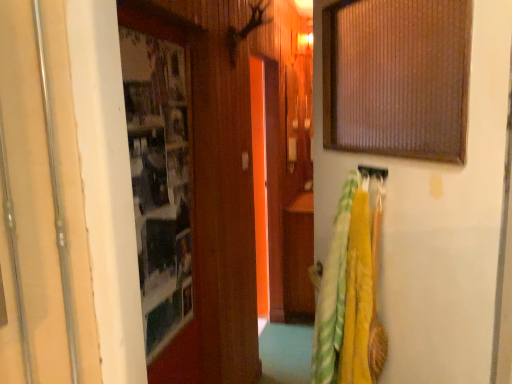
The image size is (512, 384). Identify the location of yellow fabric towel at right. click(x=351, y=290).

From the image's perspective, is metallic silver door at left beneath transparent glass door at center?

Incorrect, from the image's perspective, metallic silver door at left is higher than transparent glass door at center.

How distant is metallic silver door at left from transparent glass door at center?

The distance of metallic silver door at left from transparent glass door at center is 6.42 feet.

Considering the relative sizes of metallic silver door at left and transparent glass door at center in the image provided, is metallic silver door at left smaller than transparent glass door at center?

Yes.

The height and width of the screenshot is (384, 512). In order to click on door that appears above the transparent glass door at center (from a real-world perspective) in this screenshot , I will do pyautogui.click(x=42, y=204).

From the image's perspective, relative to metallic silver door at left, is transparent glass door at center above or below?

transparent glass door at center is below metallic silver door at left.

Considering the sizes of transparent glass door at center and metallic silver door at left in the image, is transparent glass door at center bigger or smaller than metallic silver door at left?

Considering their sizes, transparent glass door at center takes up more space than metallic silver door at left.

Is transparent glass door at center at the right side of metallic silver door at left?

Yes, transparent glass door at center is to the right of metallic silver door at left.

Considering the relative sizes of transparent glass door at center and metallic silver door at left in the image provided, is transparent glass door at center thinner than metallic silver door at left?

No, transparent glass door at center is not thinner than metallic silver door at left.

Which object is positioned more to the left, transparent glass door at center or yellow fabric towel at right?

Positioned to the left is transparent glass door at center.

From a real-world perspective, is transparent glass door at center physically located above or below yellow fabric towel at right?

From a real-world perspective, transparent glass door at center is physically below yellow fabric towel at right.

Does transparent glass door at center come in front of yellow fabric towel at right?

That is False.

Is yellow fabric towel at right in front of or behind transparent glass door at center in the image?

Clearly, yellow fabric towel at right is in front of transparent glass door at center.

Who is bigger, yellow fabric towel at right or transparent glass door at center?

transparent glass door at center is bigger.

Between point (358, 265) and point (281, 222), which one is positioned behind?

The point (281, 222) is behind.

Is the surface of yellow fabric towel at right in direct contact with transparent glass door at center?

No, yellow fabric towel at right is not making contact with transparent glass door at center.

Consider the image. Is yellow fabric towel at right wider than metallic silver door at left?

Yes.

Could you tell me if yellow fabric towel at right is turned towards metallic silver door at left?

Yes, yellow fabric towel at right is facing metallic silver door at left.

Does point (366, 263) come in front of point (38, 288)?

No.

Looking at this image, are yellow fabric towel at right and metallic silver door at left far apart?

No.

From their relative heights in the image, would you say metallic silver door at left is taller or shorter than yellow fabric towel at right?

Clearly, metallic silver door at left is taller compared to yellow fabric towel at right.

Is metallic silver door at left wider than yellow fabric towel at right?

In fact, metallic silver door at left might be narrower than yellow fabric towel at right.

Is metallic silver door at left located outside yellow fabric towel at right?

Yes, metallic silver door at left is outside of yellow fabric towel at right.

Find the location of a particular element. The height and width of the screenshot is (384, 512). screen door located underneath the metallic silver door at left (from a real-world perspective) is located at coordinates (267, 185).

At what (x,y) coordinates should I click in order to perform the action: click on screen door that is on the right side of metallic silver door at left. Please return your answer as a coordinate pair (x, y). The image size is (512, 384). Looking at the image, I should click on (267, 185).

Based on their spatial positions, is transparent glass door at center or metallic silver door at left further from yellow fabric towel at right?

transparent glass door at center.

Based on their spatial positions, is metallic silver door at left or transparent glass door at center further from yellow fabric towel at right?

transparent glass door at center is further to yellow fabric towel at right.

From the image, which object appears to be farther from metallic silver door at left, yellow fabric towel at right or transparent glass door at center?

Among the two, transparent glass door at center is located further to metallic silver door at left.

Based on the photo, when comparing their distances from metallic silver door at left, does transparent glass door at center or yellow fabric towel at right seem closer?

The object closer to metallic silver door at left is yellow fabric towel at right.

Looking at the image, which one is located further to transparent glass door at center, metallic silver door at left or yellow fabric towel at right?

metallic silver door at left.

Which object lies nearer to the anchor point transparent glass door at center, yellow fabric towel at right or metallic silver door at left?

Among the two, yellow fabric towel at right is located nearer to transparent glass door at center.

Find the location of `laundry between metallic silver door at left and transparent glass door at center from front to back`. laundry between metallic silver door at left and transparent glass door at center from front to back is located at coordinates (351, 290).